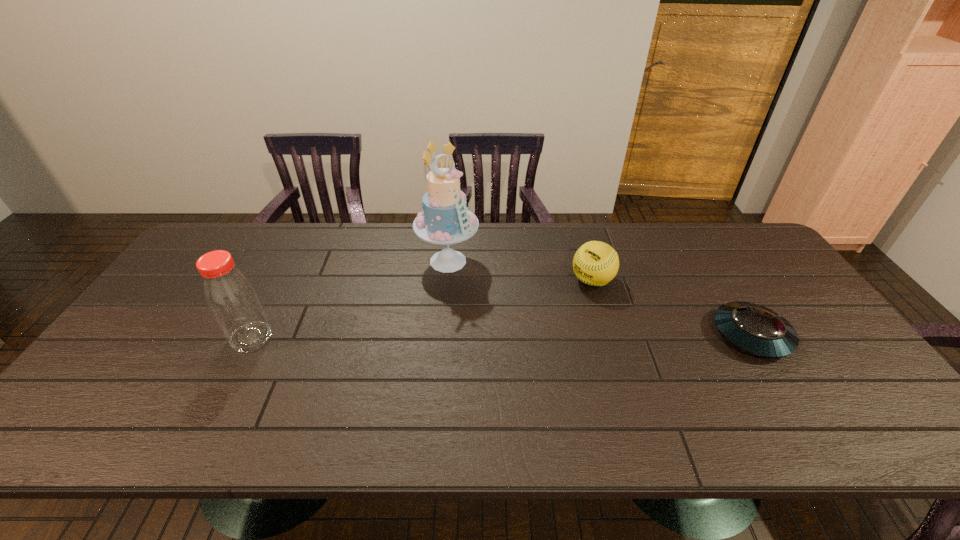
Where is `blank region between the bottle and the cake`? This screenshot has height=540, width=960. blank region between the bottle and the cake is located at coordinates (349, 299).

I want to click on vacant area between the tallest object and the bottle, so click(349, 299).

The image size is (960, 540). I want to click on empty location between the saucer and the bottle, so click(501, 336).

The width and height of the screenshot is (960, 540). I want to click on free space between the rightmost object and the cake, so pos(600,298).

Find the location of a particular element. Image resolution: width=960 pixels, height=540 pixels. vacant area between the shortest object and the third tallest object is located at coordinates (672, 308).

Identify which object is located as the second nearest to the third object from right to left. Please provide its 2D coordinates. Your answer should be formatted as a tuple, i.e. [(x, y)], where the tuple contains the x and y coordinates of a point satisfying the conditions above.

[(230, 296)]

Locate an element on the screen. object that is the closest to the shortest object is located at coordinates pyautogui.click(x=595, y=263).

This screenshot has width=960, height=540. I want to click on free space that satisfies the following two spatial constraints: 1. on the back side of the leftmost object; 2. on the left side of the tallest object, so click(290, 261).

The width and height of the screenshot is (960, 540). Find the location of `vacant point that satisfies the following two spatial constraints: 1. on the front side of the tallest object; 2. on the right side of the third tallest object`. vacant point that satisfies the following two spatial constraints: 1. on the front side of the tallest object; 2. on the right side of the third tallest object is located at coordinates (446, 281).